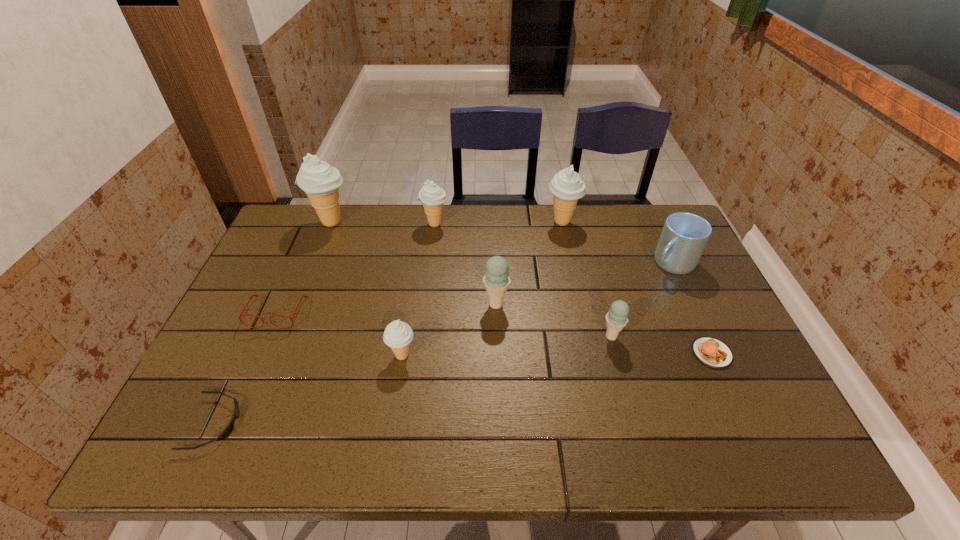
At what (x,y) coordinates should I click in order to perform the action: click on the tallest object. Please return your answer as a coordinate pair (x, y). The width and height of the screenshot is (960, 540). Looking at the image, I should click on (320, 181).

Where is `the tallest icecream`? The width and height of the screenshot is (960, 540). the tallest icecream is located at coordinates (320, 181).

The height and width of the screenshot is (540, 960). I want to click on the rightmost beige icecream, so click(x=566, y=186).

The height and width of the screenshot is (540, 960). I want to click on the second biggest beige icecream, so click(x=566, y=186).

Where is `the second smallest beige icecream`? Image resolution: width=960 pixels, height=540 pixels. the second smallest beige icecream is located at coordinates (433, 197).

Locate an element on the screen. This screenshot has height=540, width=960. the fifth object from right to left is located at coordinates (496, 280).

The image size is (960, 540). I want to click on the farther blue ice cream, so click(x=496, y=280).

Where is `the seventh nearest object`? The height and width of the screenshot is (540, 960). the seventh nearest object is located at coordinates (684, 236).

Identify the location of the smaller blue ice cream. (616, 319).

Identify the location of the nearer blue ice cream. (616, 319).